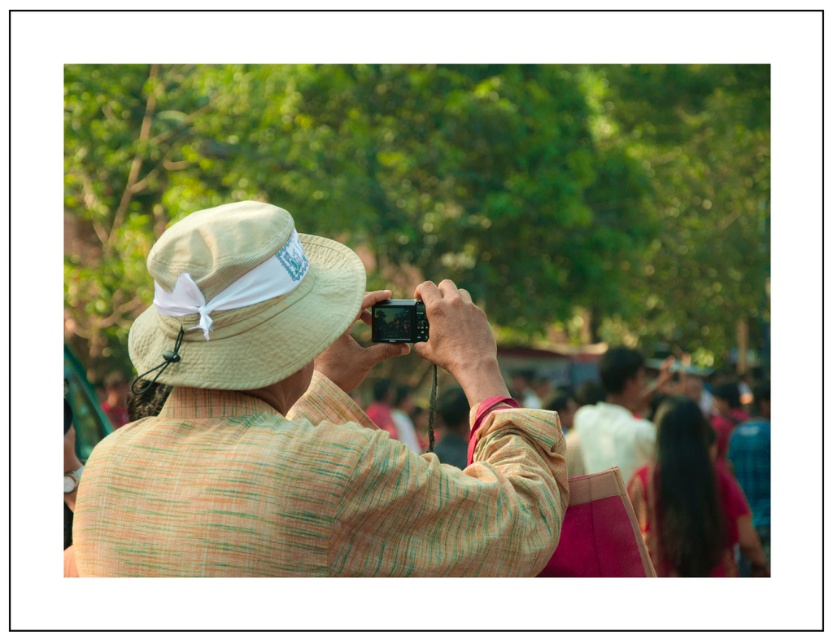
Question: Is textured beige hat at center positioned behind white cotton shirt at center?

Choices:
 (A) no
 (B) yes

Answer: (A)

Question: Does beige straw hat at center have a larger size compared to matte black camera at center?

Choices:
 (A) no
 (B) yes

Answer: (B)

Question: Which of these objects is positioned farthest from the beige straw hat at center?

Choices:
 (A) matte black camera at center
 (B) textured beige hat at center
 (C) white cotton shirt at center

Answer: (C)

Question: Where is white cotton shirt at center located in relation to matte black camera at center in the image?

Choices:
 (A) above
 (B) below

Answer: (B)

Question: Among these objects, which one is farthest from the camera?

Choices:
 (A) white cotton shirt at center
 (B) beige straw hat at center
 (C) textured beige hat at center

Answer: (A)

Question: Which point is closer to the camera?

Choices:
 (A) white cotton shirt at center
 (B) textured beige hat at center
 (C) beige straw hat at center

Answer: (B)